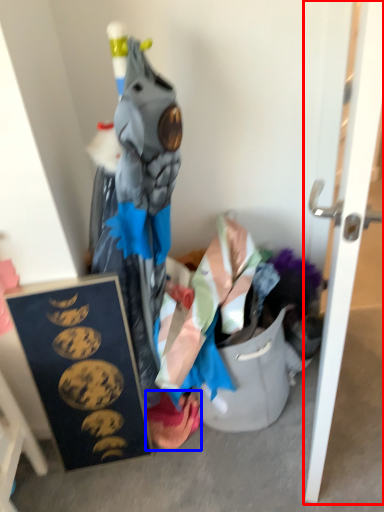
Question: Which of the following is the closest to the observer, door (highlighted by a red box) or underclothes (highlighted by a blue box)?

Choices:
 (A) door
 (B) underclothes

Answer: (A)